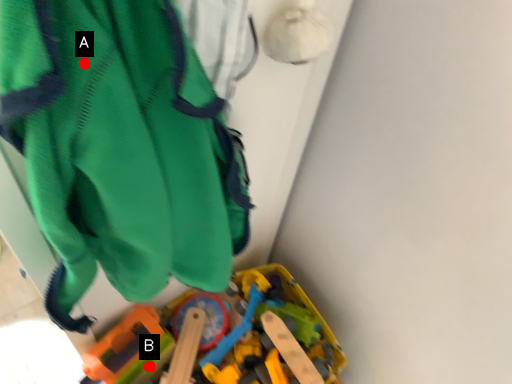
Question: Two points are circled on the image, labeled by A and B beside each circle. Among these points, which one is nearest to the camera?

Choices:
 (A) A is closer
 (B) B is closer

Answer: (A)